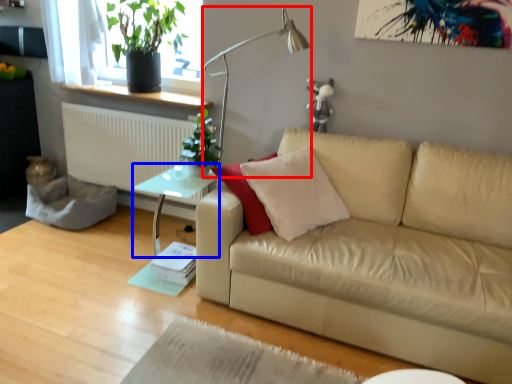
Question: Which object appears farthest to the camera in this image, table lamp (highlighted by a red box) or table (highlighted by a blue box)?

Choices:
 (A) table lamp
 (B) table

Answer: (B)